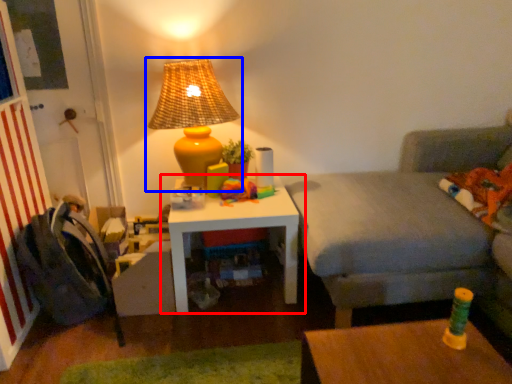
Question: Among these objects, which one is nearest to the camera, table (highlighted by a red box) or lamp (highlighted by a blue box)?

Choices:
 (A) table
 (B) lamp

Answer: (B)